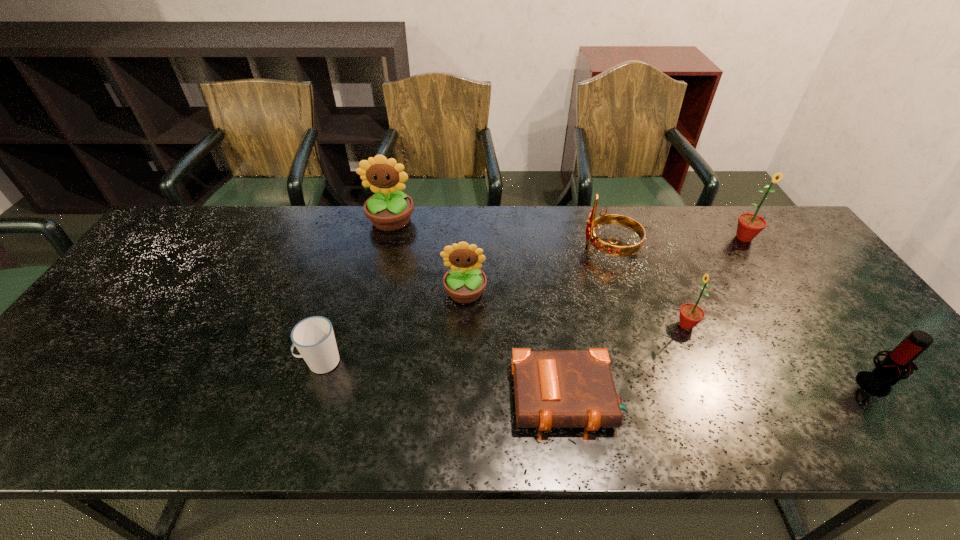
At what (x,y) coordinates should I click in order to perform the action: click on free spot that satisfies the following two spatial constraints: 1. on the front-facing side of the red microphone; 2. on the left side of the red tiara. Please return your answer as a coordinate pair (x, y). The width and height of the screenshot is (960, 540). Looking at the image, I should click on (656, 384).

Identify the location of free space in the image that satisfies the following two spatial constraints: 1. with a handle on the side of the second shortest object; 2. on the left side of the microphone. (314, 384).

This screenshot has height=540, width=960. Find the location of `free space that satisfies the following two spatial constraints: 1. on the face of the bigger green sunflower; 2. with a handle on the side of the cup`. free space that satisfies the following two spatial constraints: 1. on the face of the bigger green sunflower; 2. with a handle on the side of the cup is located at coordinates (828, 362).

This screenshot has width=960, height=540. In order to click on vacant area that satisfies the following two spatial constraints: 1. on the front-facing side of the red tiara; 2. on the spine side of the shortest object in this screenshot , I will do `click(660, 397)`.